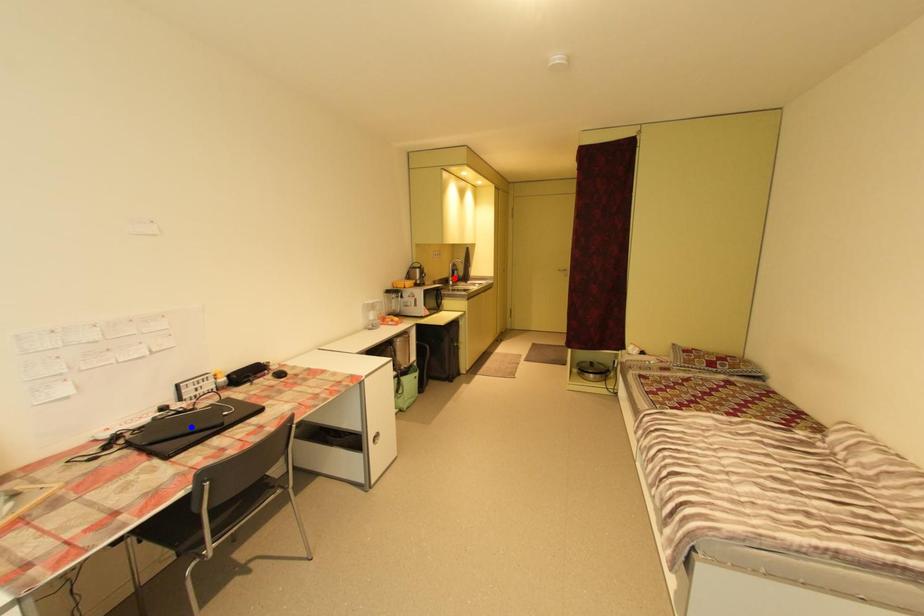
Question: Two points are marked on the image. Which point is closer to the camera?

Choices:
 (A) Blue point is closer.
 (B) Red point is closer.

Answer: (A)